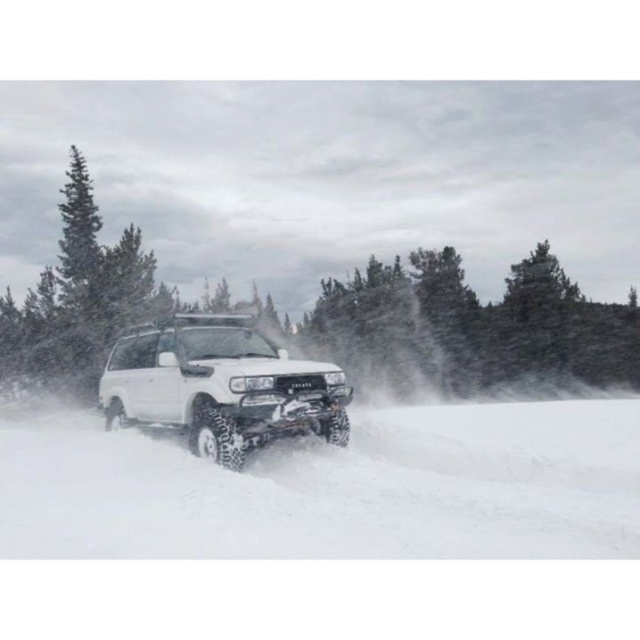
Question: Which of the following is the closest to the observer?

Choices:
 (A) white fluffy snow at center
 (B) white matte suv at center

Answer: (A)

Question: Among these points, which one is farthest from the camera?

Choices:
 (A) (164, 364)
 (B) (128, 445)

Answer: (B)

Question: Is white fluffy snow at center in front of white matte suv at center?

Choices:
 (A) no
 (B) yes

Answer: (B)

Question: Is white fluffy snow at center above white matte suv at center?

Choices:
 (A) no
 (B) yes

Answer: (A)

Question: Does white fluffy snow at center come behind white matte suv at center?

Choices:
 (A) yes
 (B) no

Answer: (B)